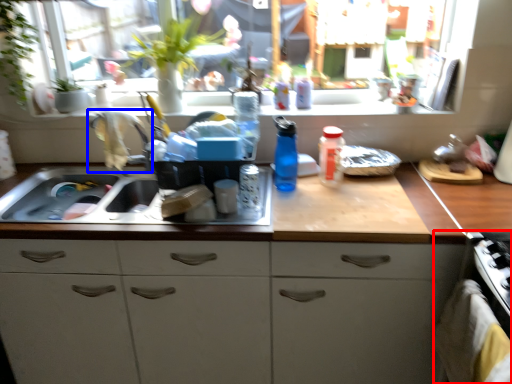
Question: Among these objects, which one is nearest to the camera, oven (highlighted by a red box) or faucet (highlighted by a blue box)?

Choices:
 (A) oven
 (B) faucet

Answer: (A)